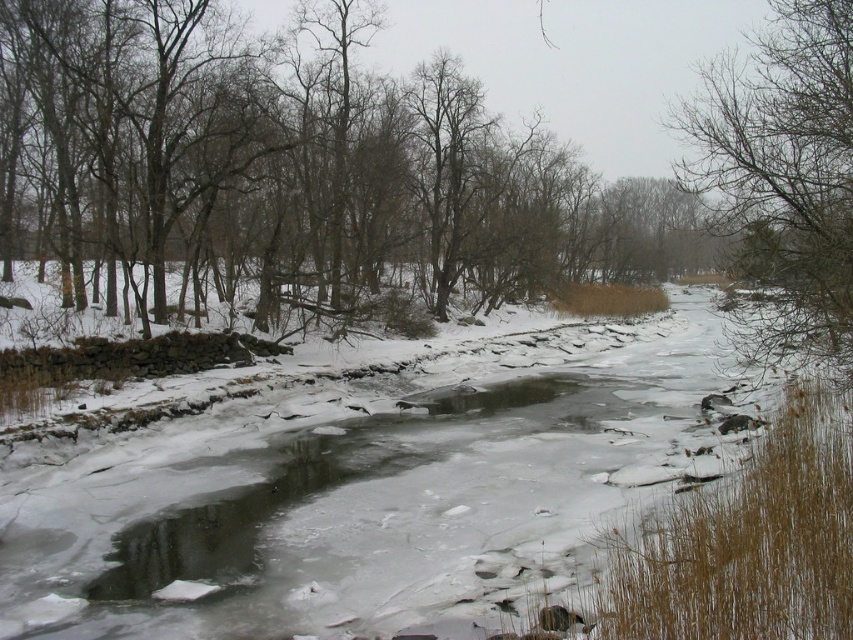
You are standing at the edge of the frozen river and see two points marked in the image. The first point is at coordinates point (155, 86) and the second is at point (788, 93). Which point is closer to you?

Point (155, 86) is closer to you because it is further to the viewer than point (788, 93).

You are an observer standing at the riverbank looking towards the center of the image. Which object, the brown bark tree at center or the bare branches at upper right, is closer to you?

The brown bark tree at center is closer to you because it is positioned under the bare branches at upper right, meaning the branches are farther away.

You are an observer standing at the edge of the riverbank. You notice the brown bark tree at center and the bare branches at upper right. Which of these two objects appears taller in the scene?

The bare branches at upper right are taller than the brown bark tree at center.